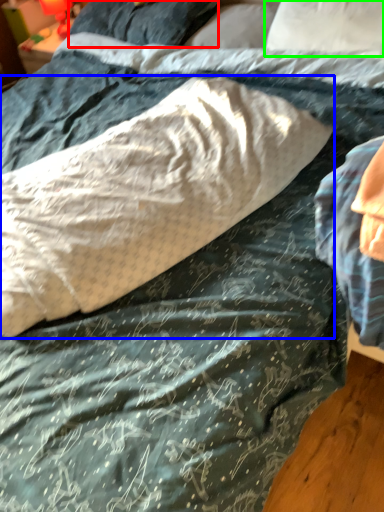
Question: Which object is the farthest from pillow (highlighted by a red box)? Choose among these: pillow (highlighted by a blue box) or pillow (highlighted by a green box).

Choices:
 (A) pillow
 (B) pillow

Answer: (A)